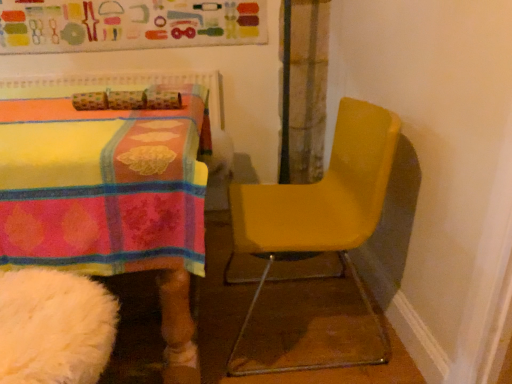
The width and height of the screenshot is (512, 384). What are the coordinates of `vacant space in yellow matte chair at right (from a real-world perspective)` in the screenshot? It's located at (293, 322).